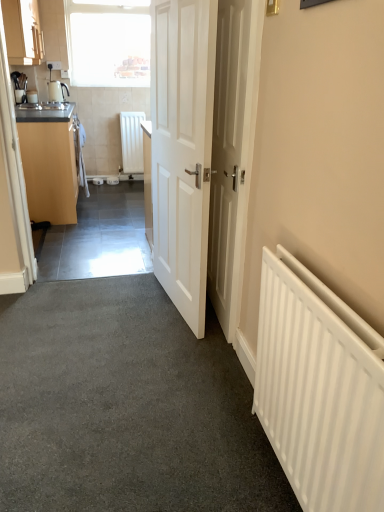
Locate an element on the screen. This screenshot has width=384, height=512. transparent glass window at upper left is located at coordinates (109, 42).

Measure the distance between point (115, 84) and camera.

The distance of point (115, 84) from camera is 5.43 meters.

Locate an element on the screen. The width and height of the screenshot is (384, 512). white matte door at center, which is the first door in right-to-left order is located at coordinates (232, 152).

What is the approximate height of matte black kettle at left?

matte black kettle at left is 10.49 inches tall.

What do you see at coordinates (57, 91) in the screenshot?
I see `matte black kettle at left` at bounding box center [57, 91].

Image resolution: width=384 pixels, height=512 pixels. Describe the element at coordinates (23, 32) in the screenshot. I see `matte wood cabinet at upper left, positioned as the 2th cabinetry in bottom-to-top order` at that location.

This screenshot has width=384, height=512. What do you see at coordinates (132, 141) in the screenshot?
I see `white matte radiator at center, which appears as the first radiator when viewed from the top` at bounding box center [132, 141].

Locate an element on the screen. The width and height of the screenshot is (384, 512). transparent glass window at upper left is located at coordinates (109, 42).

From the picture: How different are the orientations of matte black sink at left and white wooden door at center, which appears as the second door when viewed from the right, in degrees?

171 degrees.

How much distance is there between matte black sink at left and white wooden door at center, which appears as the second door when viewed from the right?

matte black sink at left is 2.15 meters from white wooden door at center, which appears as the second door when viewed from the right.

The width and height of the screenshot is (384, 512). I want to click on sink above the white wooden door at center, which is the 1th door in left-to-right order (from the image's perspective), so click(44, 106).

Is the position of matte black sink at left less distant than that of white wooden door at center, which is the 1th door in left-to-right order?

No.

Between matte wood cabinet at upper left, positioned as the 2th cabinetry in bottom-to-top order, and matte black sink at left, which one is positioned behind?

matte black sink at left is further away from the camera.

Could you tell me if matte wood cabinet at upper left, positioned as the 2th cabinetry in bottom-to-top order, is turned towards matte black sink at left?

No.

From the image's perspective, relative to matte black sink at left, is matte wood cabinet at upper left, which is the first cabinetry from top to bottom, above or below?

Clearly, from the image's perspective, matte wood cabinet at upper left, which is the first cabinetry from top to bottom, is above matte black sink at left.

Can we say matte wood cabinet at upper left, positioned as the 2th cabinetry in bottom-to-top order, lies outside matte black sink at left?

Yes, matte wood cabinet at upper left, positioned as the 2th cabinetry in bottom-to-top order, is outside of matte black sink at left.

Is white matte radiator at center, the 2th radiator positioned from the bottom, oriented away from matte black sink at left?

No, white matte radiator at center, the 2th radiator positioned from the bottom, is not facing away from matte black sink at left.

Considering the positions of point (122, 146) and point (47, 105), is point (122, 146) closer or farther from the camera than point (47, 105)?

Point (122, 146) is positioned farther from the camera compared to point (47, 105).

From the image's perspective, would you say matte black kettle at left is shown under matte wood cabinet at upper left, which is the first cabinetry from top to bottom?

Yes.

Between matte black kettle at left and matte wood cabinet at upper left, which is the first cabinetry from top to bottom, which one has larger width?

matte wood cabinet at upper left, which is the first cabinetry from top to bottom.

From a real-world perspective, which is physically above, matte black kettle at left or matte wood cabinet at upper left, which is the first cabinetry from top to bottom?

In real-world perspective, matte wood cabinet at upper left, which is the first cabinetry from top to bottom, is above.

From the picture: Can you confirm if matte black kettle at left is smaller than white matte door at center, the second door in the left-to-right sequence?

Correct, matte black kettle at left occupies less space than white matte door at center, the second door in the left-to-right sequence.

Is white matte door at center, which is the first door in right-to-left order, completely or partially inside matte black kettle at left?

No, white matte door at center, which is the first door in right-to-left order, is not inside matte black kettle at left.

Between point (52, 91) and point (235, 117), which one is positioned in front?

The point (235, 117) is closer to the camera.

From the image's perspective, between matte black kettle at left and white matte door at center, the second door in the left-to-right sequence, which one is located above?

From the image's view, matte black kettle at left is above.

Is point (227, 297) positioned before point (42, 155)?

Yes.

Locate an element on the screen. The height and width of the screenshot is (512, 384). the 2nd door below the matte wood cabinet at left, acting as the 1th cabinetry starting from the bottom (from the image's perspective) is located at coordinates (232, 152).

Which of these two, white matte door at center, which is the first door in right-to-left order, or matte wood cabinet at left, acting as the 1th cabinetry starting from the bottom, is smaller?

With smaller size is white matte door at center, which is the first door in right-to-left order.

Which of these two, white matte door at center, which is the first door in right-to-left order, or matte wood cabinet at left, acting as the 1th cabinetry starting from the bottom, stands shorter?

With less height is matte wood cabinet at left, acting as the 1th cabinetry starting from the bottom.

Could you tell me if matte black sink at left is turned towards transparent glass window at upper left?

No, matte black sink at left is not turned towards transparent glass window at upper left.

What's the angular difference between matte black sink at left and transparent glass window at upper left's facing directions?

89.6 degrees separate the facing orientations of matte black sink at left and transparent glass window at upper left.

Looking at this image, is matte black sink at left positioned far away from transparent glass window at upper left?

Yes, matte black sink at left is far from transparent glass window at upper left.

Locate an element on the screen. The image size is (384, 512). sink below the transparent glass window at upper left (from a real-world perspective) is located at coordinates (44, 106).

Find the location of a particular element. Image resolution: width=384 pixels, height=512 pixels. sink that is above the white wooden door at center, which is the 1th door in left-to-right order (from a real-world perspective) is located at coordinates (44, 106).

Identify the location of sink that appears on the right of matte wood cabinet at upper left, which is the first cabinetry from top to bottom. The image size is (384, 512). (44, 106).

From the image, which object appears to be farther from matte wood cabinet at upper left, which is the first cabinetry from top to bottom, matte wood cabinet at left, acting as the 1th cabinetry starting from the bottom, or white matte door at center, the second door in the left-to-right sequence?

The object further to matte wood cabinet at upper left, which is the first cabinetry from top to bottom, is white matte door at center, the second door in the left-to-right sequence.

When comparing their distances from transparent glass window at upper left, does white wooden door at center, which is the 1th door in left-to-right order, or matte wood cabinet at upper left, which is the first cabinetry from top to bottom, seem closer?

matte wood cabinet at upper left, which is the first cabinetry from top to bottom, is positioned closer to the anchor transparent glass window at upper left.

Consider the image. Considering their positions, is matte wood cabinet at left, acting as the 1th cabinetry starting from the bottom, positioned further to transparent glass window at upper left than matte black sink at left?

Among the two, matte black sink at left is located further to transparent glass window at upper left.

Based on their spatial positions, is white wooden door at center, which appears as the second door when viewed from the right, or matte wood cabinet at left, acting as the 1th cabinetry starting from the bottom, further from transparent glass window at upper left?

Based on the image, white wooden door at center, which appears as the second door when viewed from the right, appears to be further to transparent glass window at upper left.

From the image, which object appears to be farther from transparent glass window at upper left, white matte radiator at right, marked as the 2th radiator in a left-to-right arrangement, or matte black sink at left?

white matte radiator at right, marked as the 2th radiator in a left-to-right arrangement, is positioned further to the anchor transparent glass window at upper left.

From the image, which object appears to be farther from transparent glass window at upper left, matte wood cabinet at left, acting as the 1th cabinetry starting from the bottom, or matte wood cabinet at upper left, positioned as the 2th cabinetry in bottom-to-top order?

matte wood cabinet at left, acting as the 1th cabinetry starting from the bottom.

When comparing their distances from matte black sink at left, does white matte door at center, the second door in the left-to-right sequence, or transparent glass window at upper left seem closer?

transparent glass window at upper left.

Considering their positions, is matte black sink at left positioned closer to matte black kettle at left than matte wood cabinet at upper left, which is the first cabinetry from top to bottom?

The object closer to matte black kettle at left is matte black sink at left.

At what (x,y) coordinates should I click in order to perform the action: click on cabinetry between white matte door at center, the second door in the left-to-right sequence, and matte wood cabinet at left, acting as the 1th cabinetry starting from the bottom, from front to back. Please return your answer as a coordinate pair (x, y). Looking at the image, I should click on (23, 32).

Locate an element on the screen. The width and height of the screenshot is (384, 512). door between matte wood cabinet at upper left, which is the first cabinetry from top to bottom, and white matte door at center, the second door in the left-to-right sequence, in the up-down direction is located at coordinates (203, 149).

Locate an element on the screen. Image resolution: width=384 pixels, height=512 pixels. door between white wooden door at center, which appears as the second door when viewed from the right, and matte wood cabinet at left, acting as the 1th cabinetry starting from the bottom, from front to back is located at coordinates (232, 152).

Where is `door between white wooden door at center, which is the 1th door in left-to-right order, and matte black sink at left, along the z-axis`? The image size is (384, 512). door between white wooden door at center, which is the 1th door in left-to-right order, and matte black sink at left, along the z-axis is located at coordinates (232, 152).